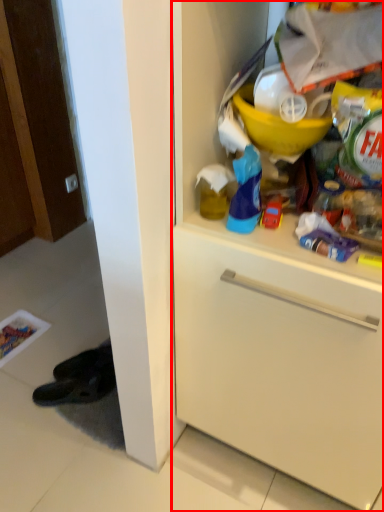
Question: From the image's perspective, what is the correct spatial positioning of cabinetry (annotated by the red box) in reference to toy?

Choices:
 (A) above
 (B) below

Answer: (B)